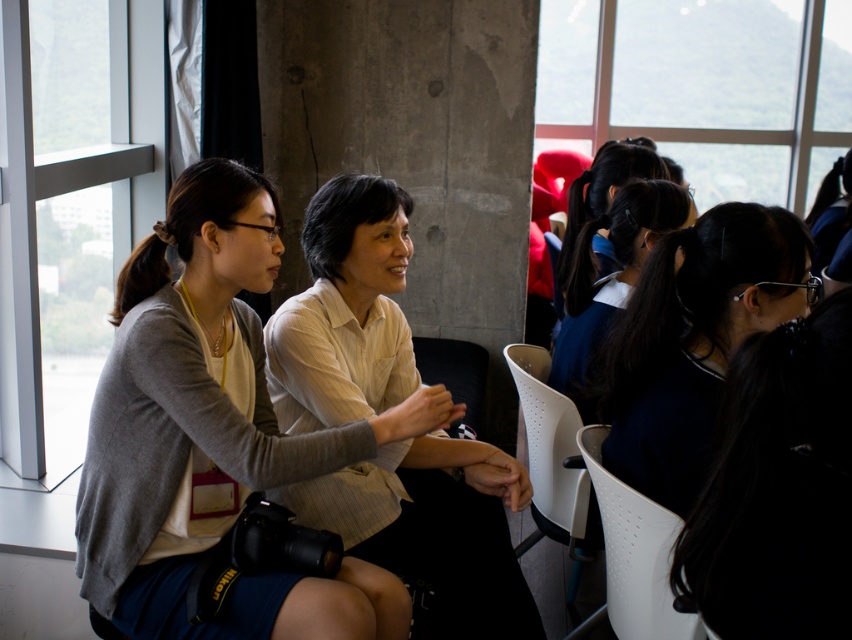
Question: Is clear glass window at left in front of dark blue fabric hair tie at center?

Choices:
 (A) no
 (B) yes

Answer: (A)

Question: Is matte gray sweater at center positioned before black fabric chair at center?

Choices:
 (A) yes
 (B) no

Answer: (A)

Question: Where is white perforated chair at center located in relation to dark blue hair at center in the image?

Choices:
 (A) right
 (B) left

Answer: (B)

Question: Estimate the real-world distances between objects in this image. Which object is closer to the dark blue fabric hair tie at center?

Choices:
 (A) matte gray sweater at center
 (B) black fabric chair at center

Answer: (A)

Question: Which object is positioned farthest from the dark blue hair at center?

Choices:
 (A) dark blue uniform at center
 (B) matte gray sweater at center
 (C) clear glass window at left

Answer: (C)

Question: Which point appears closest to the camera in this image?

Choices:
 (A) (145, 144)
 (B) (619, 195)
 (C) (127, 580)

Answer: (C)